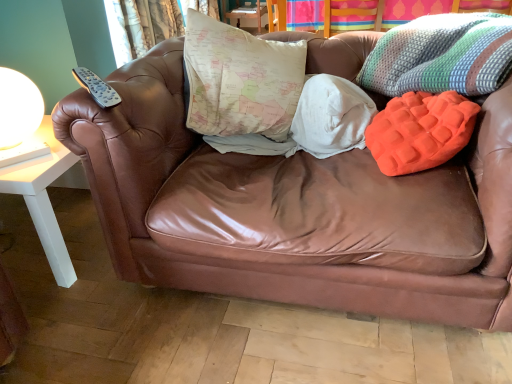
Question: In terms of height, does map-patterned fabric pillow at center, which ranks as the 1th pillow in left-to-right order, look taller or shorter compared to knitted multicolored throw pillow at upper right?

Choices:
 (A) short
 (B) tall

Answer: (B)

Question: Is map-patterned fabric pillow at center, which ranks as the 1th pillow in left-to-right order, in front of or behind knitted multicolored throw pillow at upper right in the image?

Choices:
 (A) front
 (B) behind

Answer: (B)

Question: Which is farther from the map-patterned fabric pillow at center, the second pillow when ordered from right to left?

Choices:
 (A) orange textured pillow at right, the first pillow viewed from the right
 (B) knitted multicolored throw pillow at upper right
 (C) white glossy table lamp at left
 (D) textured fabric curtain at upper left

Answer: (D)

Question: Estimate the real-world distances between objects in this image. Which object is farther from the textured fabric curtain at upper left?

Choices:
 (A) white glossy table lamp at left
 (B) map-patterned fabric pillow at center, which ranks as the 1th pillow in left-to-right order
 (C) orange textured pillow at right, acting as the second pillow starting from the left
 (D) knitted multicolored throw pillow at upper right

Answer: (C)